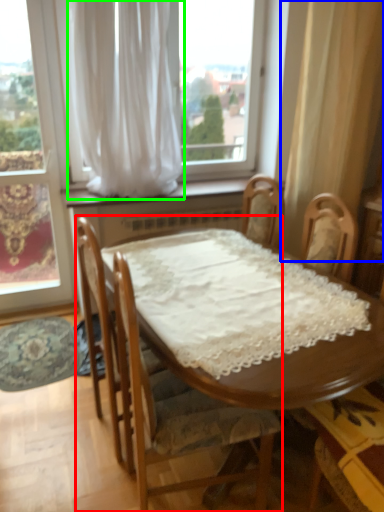
Question: Considering the real-world distances, which object is farthest from chair (highlighted by a red box)? curtain (highlighted by a blue box) or curtain (highlighted by a green box)?

Choices:
 (A) curtain
 (B) curtain

Answer: (A)